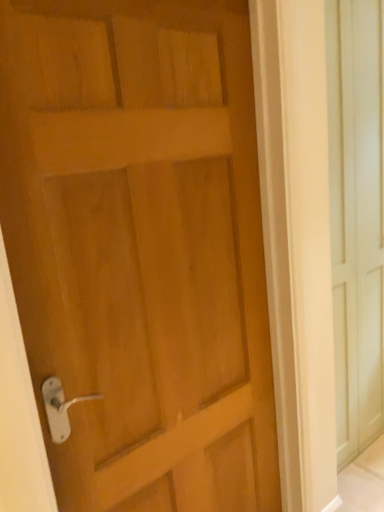
You are a GUI agent. You are given a task and a screenshot of the screen. Output one action in this format:
    pyautogui.click(x=<x>, y=<y>)
    Task: Click on the wooden door at center
    Image resolution: width=384 pixels, height=512 pixels.
    Given the screenshot: What is the action you would take?
    pyautogui.click(x=141, y=248)

What do you see at coordinates (141, 248) in the screenshot? The image size is (384, 512). I see `wooden door at center` at bounding box center [141, 248].

Find the location of a particular element. The height and width of the screenshot is (512, 384). wooden door at center is located at coordinates (141, 248).